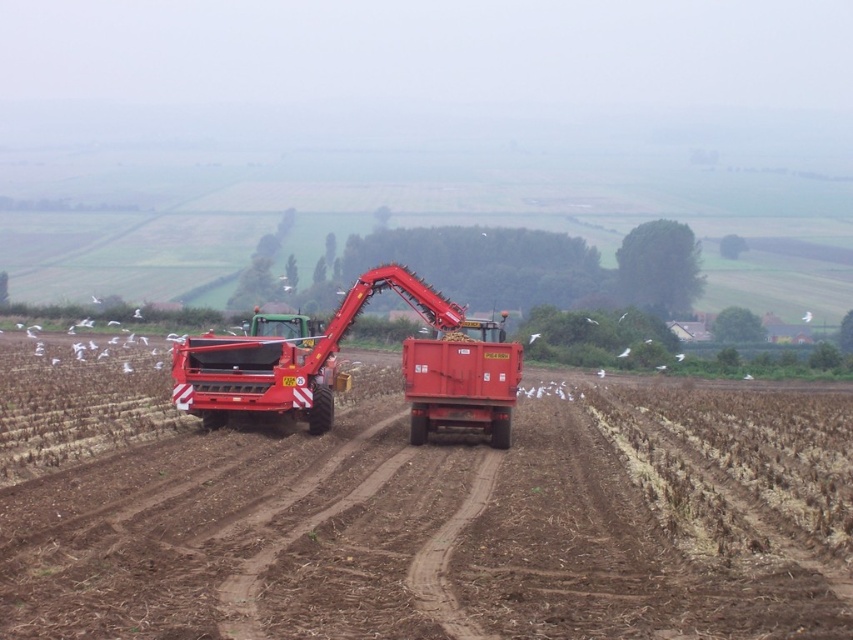
Who is shorter, dirt field at center or white feathered bird at center?

white feathered bird at center

Does point (820, 397) come closer to viewer compared to point (627, 353)?

Yes.

Identify the location of dirt field at center. (456, 524).

Who is taller, dirt field at center or matte red trailer truck at center?

Standing taller between the two is dirt field at center.

From the picture: Who is higher up, dirt field at center or matte red trailer truck at center?

matte red trailer truck at center is higher up.

Is point (677, 576) closer to viewer compared to point (202, 342)?

Yes, point (677, 576) is in front of point (202, 342).

You are a GUI agent. You are given a task and a screenshot of the screen. Output one action in this format:
    pyautogui.click(x=<x>, y=<y>)
    Task: Click on the dirt field at center
    The width and height of the screenshot is (853, 640).
    Given the screenshot: What is the action you would take?
    pyautogui.click(x=456, y=524)

Is matte red trailer truck at center to the right of white feathered bird at center from the viewer's perspective?

In fact, matte red trailer truck at center is to the left of white feathered bird at center.

Based on the photo, is matte red trailer truck at center above white feathered bird at center?

Incorrect, matte red trailer truck at center is not positioned above white feathered bird at center.

Where is `matte red trailer truck at center`? This screenshot has height=640, width=853. matte red trailer truck at center is located at coordinates (345, 372).

Find the location of a particular element. matte red trailer truck at center is located at coordinates (345, 372).